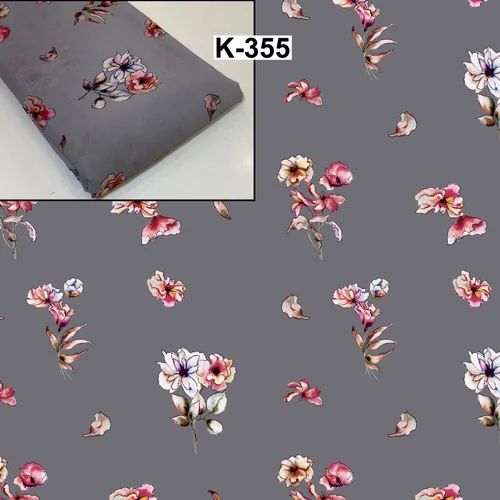
Locate an element on the screen. This screenshot has height=500, width=500. white surface is located at coordinates click(x=192, y=171).